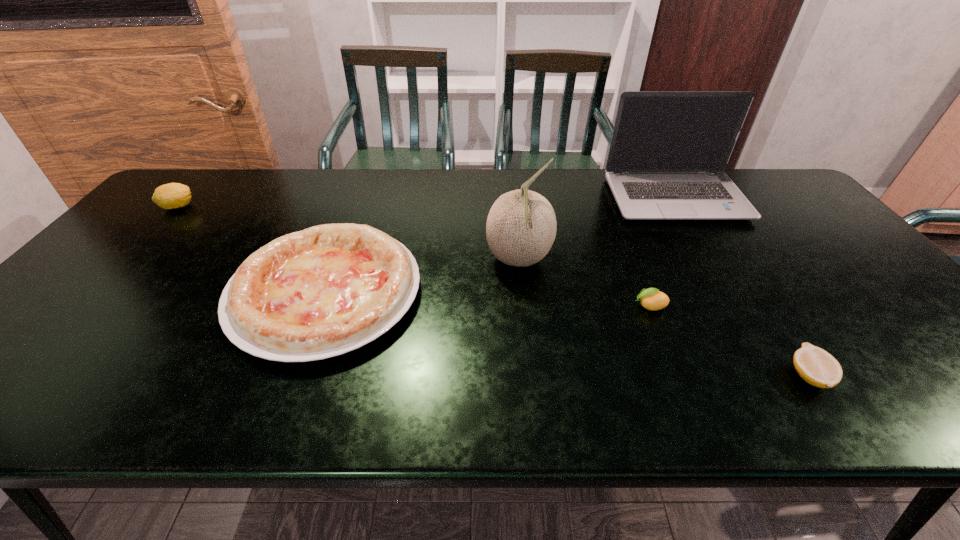
Where is `vacant region at the far edge of the desktop`? vacant region at the far edge of the desktop is located at coordinates (372, 182).

At what (x,y) coordinates should I click in order to perform the action: click on vacant space at the near edge of the desktop. Please return your answer as a coordinate pair (x, y). Image resolution: width=960 pixels, height=540 pixels. Looking at the image, I should click on (832, 391).

The image size is (960, 540). Find the location of `vacant space at the left edge`. vacant space at the left edge is located at coordinates (188, 212).

I want to click on vacant position at the right edge of the desktop, so click(923, 321).

Find the location of `free space between the second object from left to right and the fourth object from right to left`. free space between the second object from left to right and the fourth object from right to left is located at coordinates (422, 276).

Locate an element on the screen. This screenshot has width=960, height=540. unoccupied area between the leftmost object and the fifth object from right to left is located at coordinates (252, 250).

Where is `vacant space that's between the second lemon from left to right and the laptop computer`? The image size is (960, 540). vacant space that's between the second lemon from left to right and the laptop computer is located at coordinates (662, 253).

This screenshot has height=540, width=960. I want to click on free spot between the laptop computer and the second lemon from left to right, so click(662, 253).

This screenshot has width=960, height=540. In order to click on vacant area between the second lemon from left to right and the rightmost lemon in this screenshot , I will do `click(730, 341)`.

Where is `free space between the cantaloup and the laptop computer`? This screenshot has height=540, width=960. free space between the cantaloup and the laptop computer is located at coordinates [x=597, y=230].